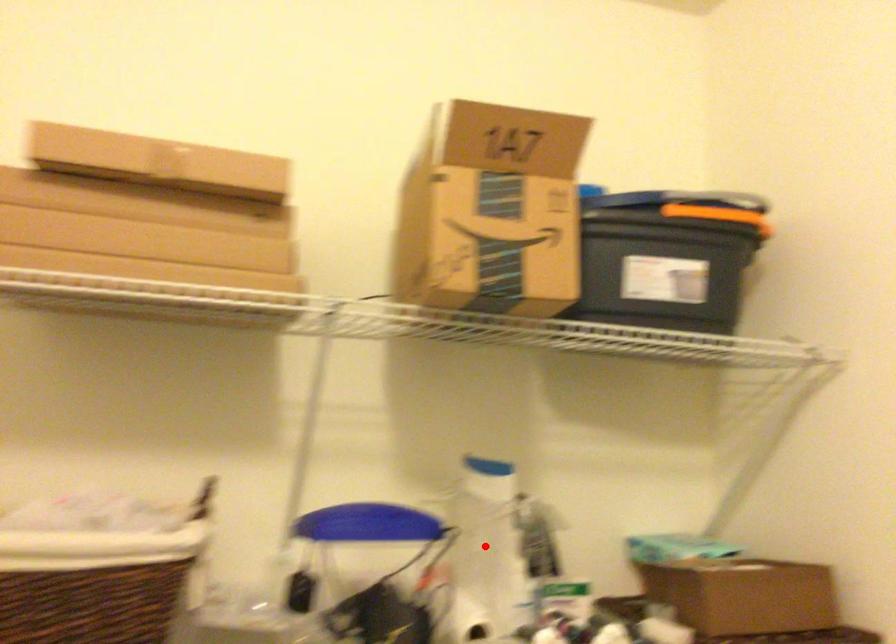
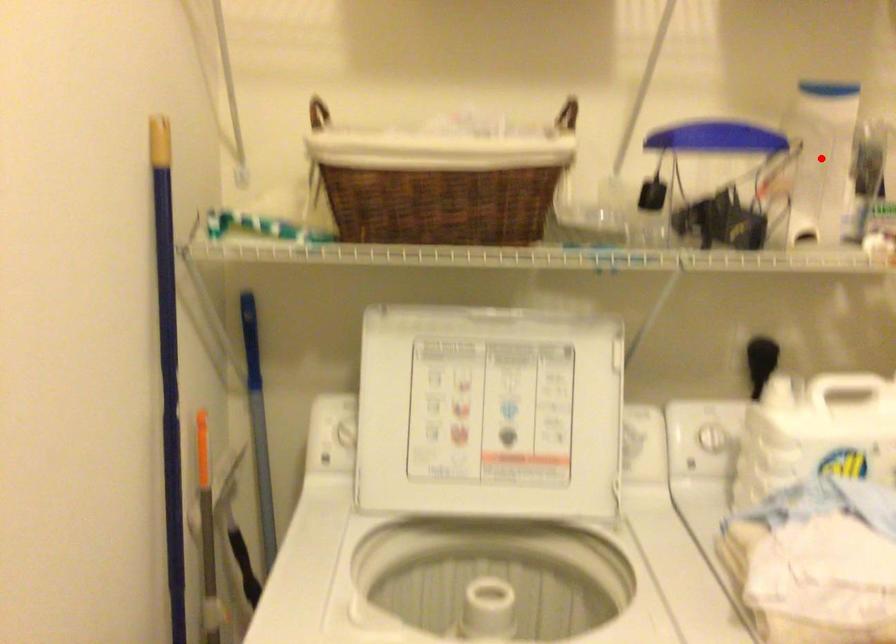
I am providing you with two images of the same scene from different viewpoints. A red point is marked on the first image and another point is marked on the second image. Are the points marked in image1 and image2 representing the same 3D position?

Yes